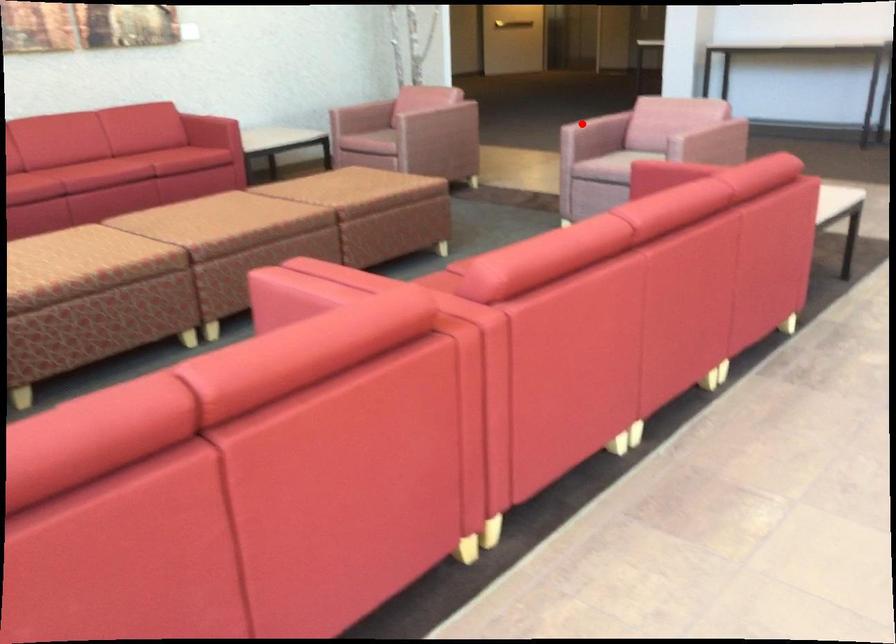
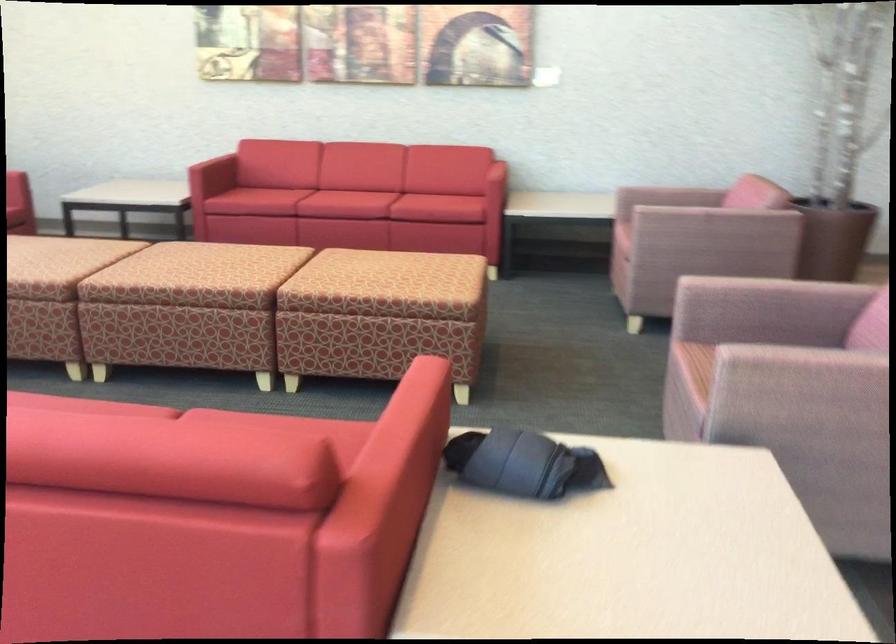
Question: I am providing you with two images of the same scene from different viewpoints. Image1 has a red point marked. In image2, the corresponding 3D location appears at what relative position? Reply with the corresponding letter.

Choices:
 (A) Closer
 (B) Farther

Answer: (A)